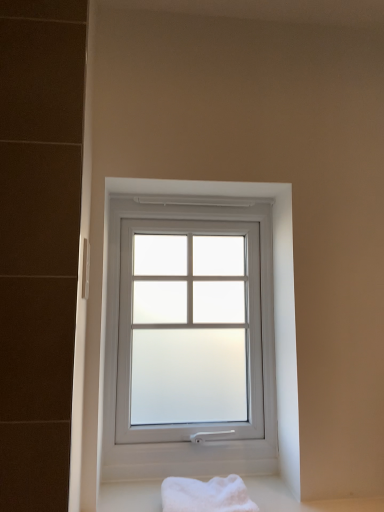
Question: Considering their positions, is white frosted glass window at center located in front of or behind white soft bath towel at lower center?

Choices:
 (A) behind
 (B) front

Answer: (A)

Question: From their relative heights in the image, would you say white frosted glass window at center is taller or shorter than white soft bath towel at lower center?

Choices:
 (A) short
 (B) tall

Answer: (B)

Question: From a real-world perspective, relative to white soft bath towel at lower center, is white frosted glass window at center vertically above or below?

Choices:
 (A) below
 (B) above

Answer: (B)

Question: Do you think white soft bath towel at lower center is within white frosted glass window at center, or outside of it?

Choices:
 (A) outside
 (B) inside

Answer: (A)

Question: In terms of width, does white soft bath towel at lower center look wider or thinner when compared to white frosted glass window at center?

Choices:
 (A) wide
 (B) thin

Answer: (A)

Question: In the image, is white soft bath towel at lower center positioned in front of or behind white frosted glass window at center?

Choices:
 (A) behind
 (B) front

Answer: (B)

Question: From the image's perspective, is white soft bath towel at lower center located above or below white frosted glass window at center?

Choices:
 (A) above
 (B) below

Answer: (B)